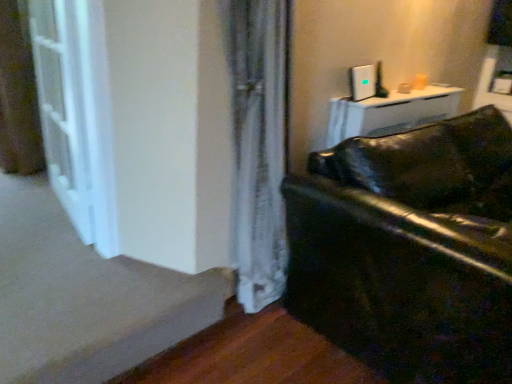
Image resolution: width=512 pixels, height=384 pixels. What do you see at coordinates (76, 114) in the screenshot?
I see `white glossy screen door at left` at bounding box center [76, 114].

I want to click on glossy black leather couch at lower right, so click(409, 250).

What do you see at coordinates (85, 297) in the screenshot?
I see `smooth beige carpet at lower left` at bounding box center [85, 297].

This screenshot has height=384, width=512. What are the coordinates of `white glossy screen door at left` in the screenshot? It's located at (76, 114).

At what (x,y) coordinates should I click in order to perform the action: click on screen door that is above the smooth beige carpet at lower left (from the image's perspective). Please return your answer as a coordinate pair (x, y). Image resolution: width=512 pixels, height=384 pixels. Looking at the image, I should click on (76, 114).

Who is bigger, white glossy screen door at left or smooth beige carpet at lower left?

With larger size is white glossy screen door at left.

Between white glossy screen door at left and smooth beige carpet at lower left, which one appears on the right side from the viewer's perspective?

smooth beige carpet at lower left is more to the right.

From the image's perspective, would you say white glossy screen door at left is shown under smooth beige carpet at lower left?

No.

Considering the sizes of objects glossy black leather couch at lower right and white glossy screen door at left in the image provided, who is thinner, glossy black leather couch at lower right or white glossy screen door at left?

white glossy screen door at left.

Can we say glossy black leather couch at lower right lies outside white glossy screen door at left?

glossy black leather couch at lower right is positioned outside white glossy screen door at left.

Are glossy black leather couch at lower right and white glossy screen door at left located far from each other?

glossy black leather couch at lower right is far away from white glossy screen door at left.

Which of these two, glossy black leather couch at lower right or white glossy screen door at left, is smaller?

With smaller size is white glossy screen door at left.

Considering the sizes of objects smooth beige carpet at lower left and white glossy screen door at left in the image provided, who is smaller, smooth beige carpet at lower left or white glossy screen door at left?

smooth beige carpet at lower left.

Considering the relative sizes of smooth beige carpet at lower left and white glossy screen door at left in the image provided, is smooth beige carpet at lower left thinner than white glossy screen door at left?

No, smooth beige carpet at lower left is not thinner than white glossy screen door at left.

Could you tell me if smooth beige carpet at lower left is facing white glossy screen door at left?

No, smooth beige carpet at lower left is not turned towards white glossy screen door at left.

In the image, is white glossy screen door at left positioned in front of or behind glossy black leather couch at lower right?

white glossy screen door at left is behind glossy black leather couch at lower right.

Would you say white glossy screen door at left is to the left or to the right of glossy black leather couch at lower right in the picture?

white glossy screen door at left is positioned on glossy black leather couch at lower right's left side.

Who is shorter, white glossy screen door at left or glossy black leather couch at lower right?

glossy black leather couch at lower right is shorter.

Is smooth beige carpet at lower left placed right next to glossy black leather couch at lower right?

smooth beige carpet at lower left and glossy black leather couch at lower right are not in contact.

Looking at this image, which of these two, smooth beige carpet at lower left or glossy black leather couch at lower right, is smaller?

smooth beige carpet at lower left.

From the image's perspective, is smooth beige carpet at lower left above or below glossy black leather couch at lower right?

From the image's perspective, smooth beige carpet at lower left appears below glossy black leather couch at lower right.

Which is more to the left, smooth beige carpet at lower left or glossy black leather couch at lower right?

smooth beige carpet at lower left is more to the left.

From a real-world perspective, is glossy black leather couch at lower right below smooth beige carpet at lower left?

Actually, glossy black leather couch at lower right is physically above smooth beige carpet at lower left in the real world.

How many degrees apart are the facing directions of glossy black leather couch at lower right and smooth beige carpet at lower left?

0.585 degrees.

Which is behind, glossy black leather couch at lower right or smooth beige carpet at lower left?

smooth beige carpet at lower left is more distant.

Is glossy black leather couch at lower right wider or thinner than smooth beige carpet at lower left?

In the image, glossy black leather couch at lower right appears to be wider than smooth beige carpet at lower left.

Where is `stairwell below the white glossy screen door at left (from the image's perspective)`? stairwell below the white glossy screen door at left (from the image's perspective) is located at coordinates (85, 297).

Locate an element on the screen. Image resolution: width=512 pixels, height=384 pixels. studio couch that appears on the right of white glossy screen door at left is located at coordinates (409, 250).

From the image, which object appears to be nearer to smooth beige carpet at lower left, glossy black leather couch at lower right or white glossy screen door at left?

white glossy screen door at left is positioned closer to the anchor smooth beige carpet at lower left.

Looking at the image, which one is located further to glossy black leather couch at lower right, smooth beige carpet at lower left or white glossy screen door at left?

The object further to glossy black leather couch at lower right is white glossy screen door at left.

Estimate the real-world distances between objects in this image. Which object is closer to white glossy screen door at left, glossy black leather couch at lower right or smooth beige carpet at lower left?

The object closer to white glossy screen door at left is smooth beige carpet at lower left.

Based on their spatial positions, is white glossy screen door at left or smooth beige carpet at lower left further from glossy black leather couch at lower right?

white glossy screen door at left.

Considering their positions, is white glossy screen door at left positioned closer to smooth beige carpet at lower left than glossy black leather couch at lower right?

white glossy screen door at left is closer to smooth beige carpet at lower left.

When comparing their distances from white glossy screen door at left, does smooth beige carpet at lower left or glossy black leather couch at lower right seem closer?

smooth beige carpet at lower left.

Locate an element on the screen. This screenshot has width=512, height=384. stairwell located between white glossy screen door at left and glossy black leather couch at lower right in the left-right direction is located at coordinates (85, 297).